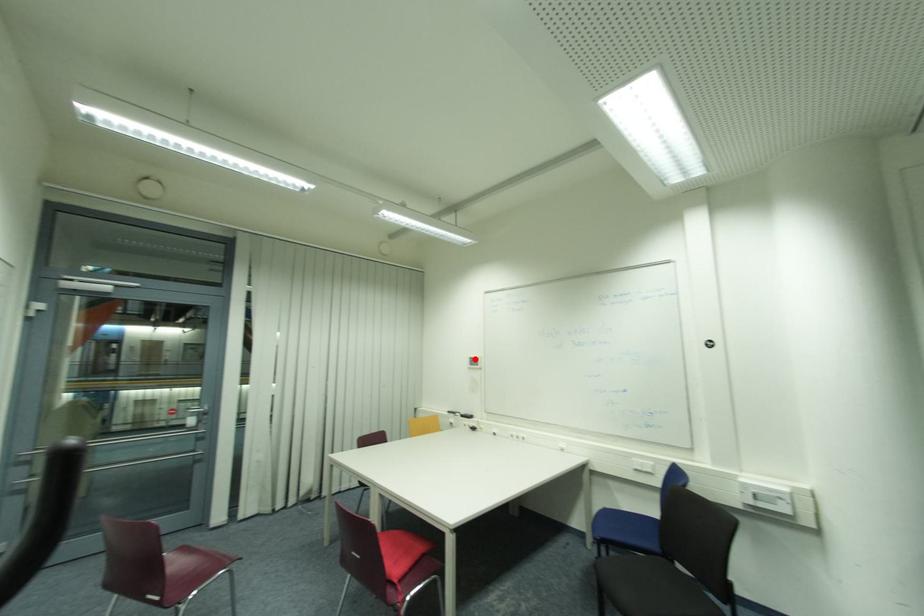
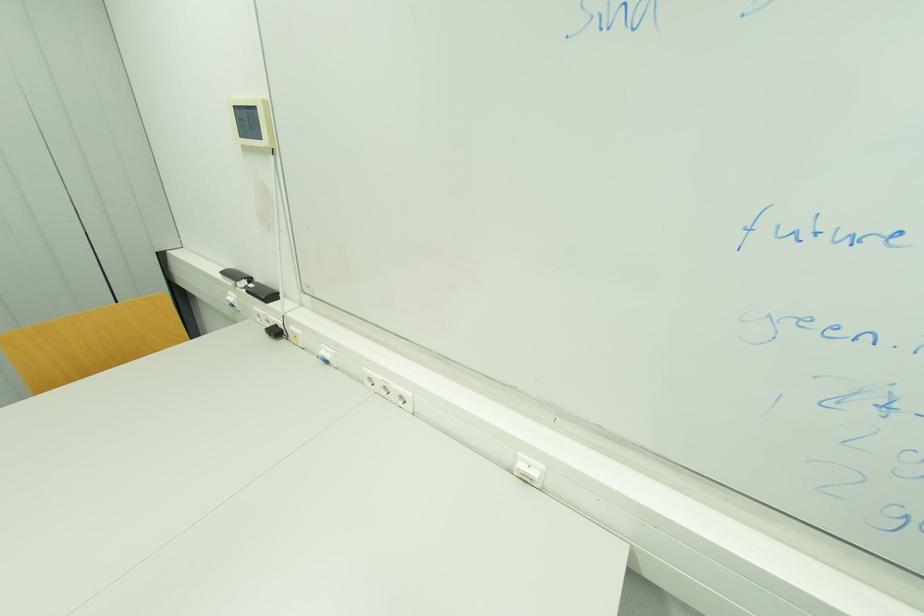
Locate, in the second image, the point that corresponds to the highlighted location in the first image.

(237, 108)